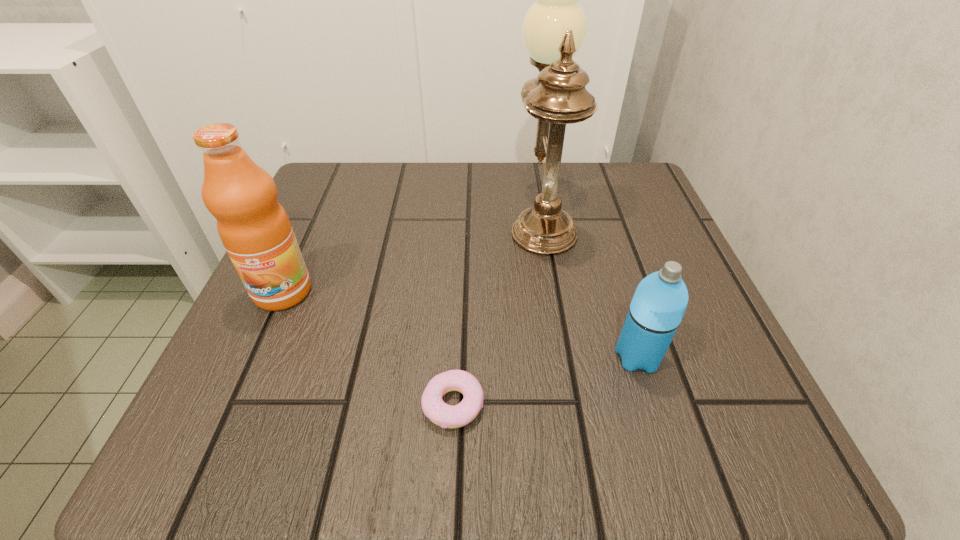
Locate an element on the screen. This screenshot has width=960, height=540. empty location between the doughnut and the oil lamp is located at coordinates (497, 309).

This screenshot has height=540, width=960. Identify the location of free space between the doughnut and the second farthest object. (368, 348).

Find the location of a particular element. This screenshot has height=540, width=960. free space between the fruit juice and the oil lamp is located at coordinates (412, 253).

Identify the location of the closest object relative to the doughnut. Image resolution: width=960 pixels, height=540 pixels. (660, 300).

Locate an element on the screen. the second closest object to the thermos bottle is located at coordinates (435, 409).

I want to click on free point that satisfies the following two spatial constraints: 1. on the front side of the tallest object; 2. on the left side of the second shortest object, so click(x=564, y=357).

Where is `free space that satisfies the following two spatial constraints: 1. on the label side of the nearest object; 2. on the right side of the fruit juice`? This screenshot has height=540, width=960. free space that satisfies the following two spatial constraints: 1. on the label side of the nearest object; 2. on the right side of the fruit juice is located at coordinates (232, 404).

Locate an element on the screen. vacant space that satisfies the following two spatial constraints: 1. on the back side of the nearest object; 2. on the right side of the third farthest object is located at coordinates (456, 357).

The image size is (960, 540). I want to click on vacant region that satisfies the following two spatial constraints: 1. on the back side of the second nearest object; 2. on the left side of the third object from right to left, so (456, 357).

At what (x,y) coordinates should I click in order to perform the action: click on vacant area in the image that satisfies the following two spatial constraints: 1. on the label side of the leftmost object; 2. on the left side of the second object from left to right. Please return your answer as a coordinate pair (x, y). Looking at the image, I should click on (232, 404).